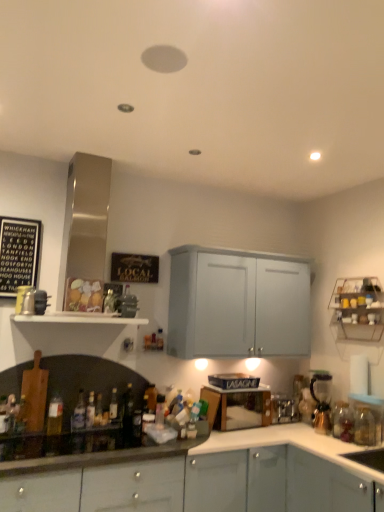
This screenshot has width=384, height=512. Find the location of `free location in front of gold metallic coffee machine at right`. free location in front of gold metallic coffee machine at right is located at coordinates click(x=313, y=437).